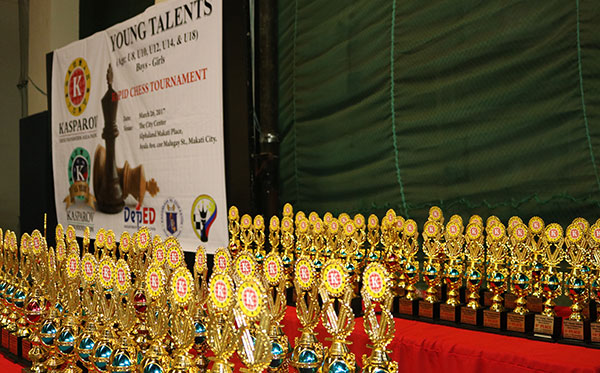
Find the location of a particular element. This screenshot has height=373, width=600. black horizontal curtain is located at coordinates (498, 137).